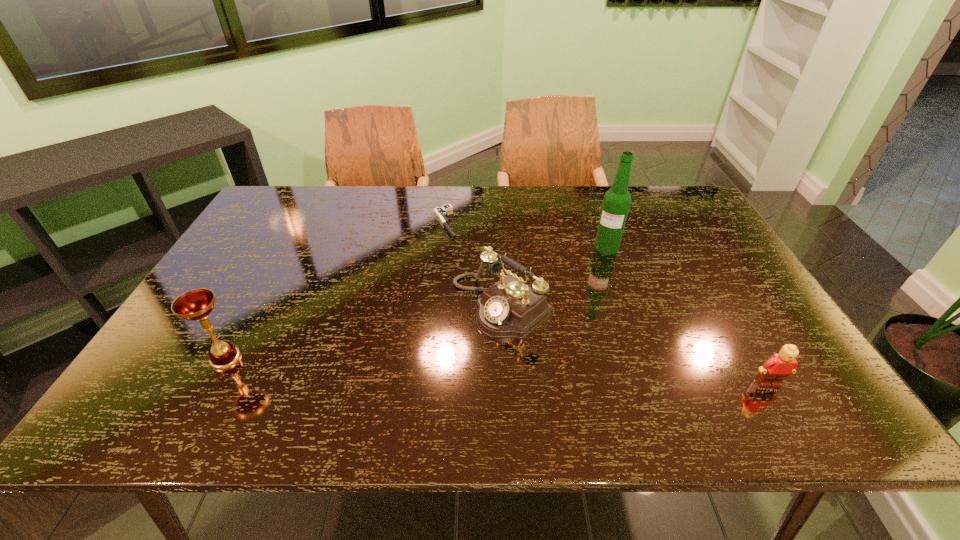
Where is `free space on the desktop that is between the chalice and the fourth tallest object and is positioned on the label of the second object from right to left`? free space on the desktop that is between the chalice and the fourth tallest object and is positioned on the label of the second object from right to left is located at coordinates (571, 374).

Locate an element on the screen. The height and width of the screenshot is (540, 960). vacant spot on the desktop that is between the leftmost object and the nearest object and is positioned on the dial of the telephone is located at coordinates (418, 367).

Locate an element on the screen. Image resolution: width=960 pixels, height=540 pixels. vacant space on the desktop that is between the second nearest object and the fourth tallest object and is positioned on the front-facing side of the farthest object is located at coordinates (556, 374).